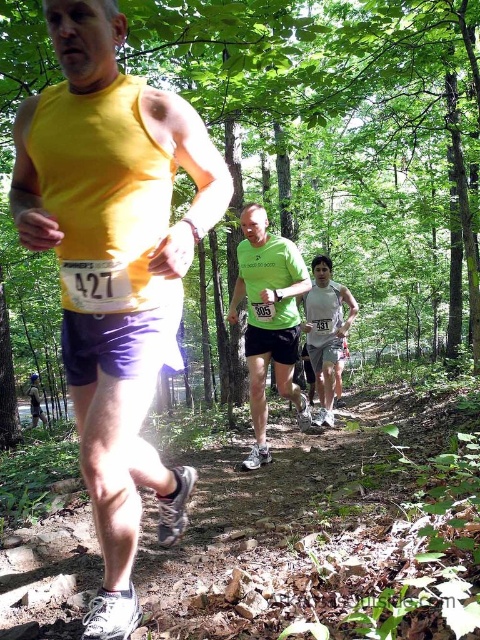
You are a drone operator assigned to track runners in a forest trail race. Your task is to locate the runner wearing a matte yellow tank top at center. According to the coordinates provided, where exactly is this runner positioned in the image?

The runner wearing the matte yellow tank top at center is positioned at coordinates point (113, 268).

In the scene shown: You are a photographer positioned at the starting line of the trail run. You want to capture a photo of both the matte yellow tank top at center and the white mesh tank top at center in the same frame. Given that your camera has a maximum focus range of 5 meters, will both runners be in focus?

The matte yellow tank top at center is 4.43 meters away from the white mesh tank top at center. Since the distance between them is within the camera s maximum focus range of 5 meters, both runners will be in focus in the photo.